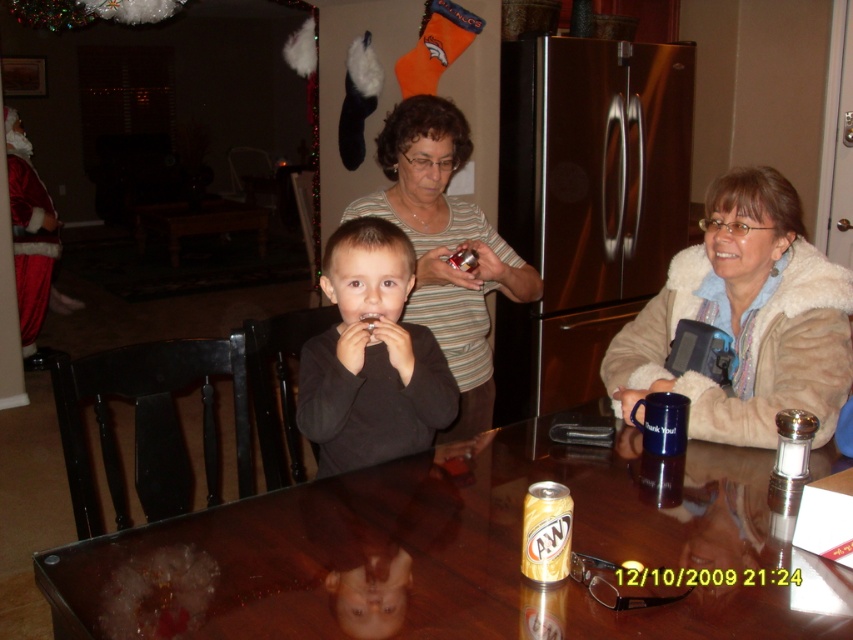
Question: Does black matte shirt at center appear over striped knit sweater at center?

Choices:
 (A) yes
 (B) no

Answer: (B)

Question: Observing the image, what is the correct spatial positioning of glossy brown table at center in reference to black matte shirt at center?

Choices:
 (A) below
 (B) above

Answer: (A)

Question: Does black matte shirt at center appear under gold metallic can at center?

Choices:
 (A) yes
 (B) no

Answer: (B)

Question: Which point is closer to the camera?

Choices:
 (A) (741, 228)
 (B) (543, 483)
 (C) (418, 392)
 (D) (460, 285)

Answer: (B)

Question: Which of the following is the farthest from the observer?

Choices:
 (A) (767, 486)
 (B) (735, 438)
 (C) (341, 468)
 (D) (465, 208)

Answer: (D)

Question: Based on their relative distances, which object is nearer to the gold metallic can at center?

Choices:
 (A) glossy brown table at center
 (B) striped knit sweater at center
 (C) fuzzy beige coat at right

Answer: (A)